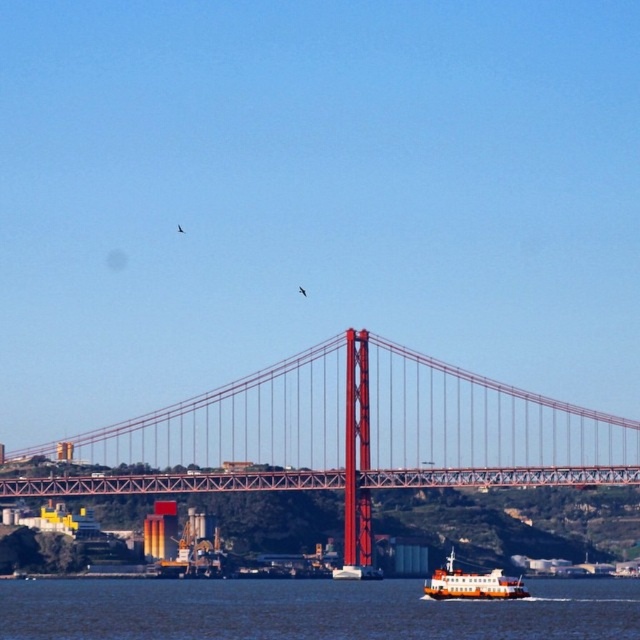
You are standing on the suspension bridge and looking towards the ferry boat in the foreground. Which of the two points, point (429, 465) or point (513, 596), is closer to you?

Point (429, 465) is closer to the camera than point (513, 596), so it is closer to you.

You are a photographer planning to capture the ferry boat and the bridge in a single shot. Given that the blue water at lower center and the orange matte ferryboat at lower center are both in the frame, which one occupies a larger area in the photo?

The blue water at lower center occupies a larger area in the photo because its width is greater than that of the orange matte ferryboat at lower center.